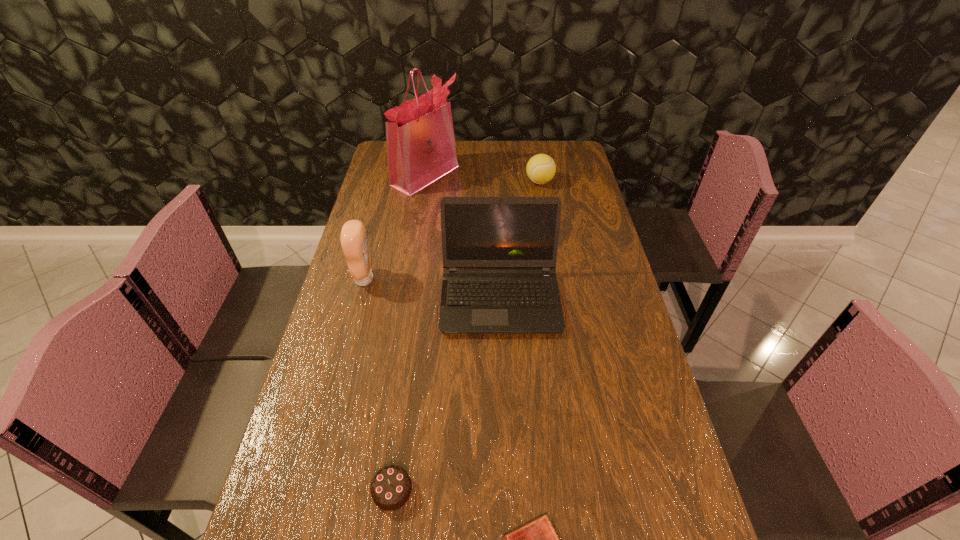
Where is `the tallest object`? This screenshot has width=960, height=540. the tallest object is located at coordinates (421, 148).

Find the location of a particular element. The image size is (960, 540). the fifth shortest object is located at coordinates (499, 254).

The image size is (960, 540). I want to click on condiment, so click(x=353, y=237).

Find the location of a particular element. The image size is (960, 540). tennis ball is located at coordinates (541, 168).

Identify the location of the second nearest object. The height and width of the screenshot is (540, 960). (391, 488).

Identify the location of chocolate cake. This screenshot has height=540, width=960. (391, 488).

Identify the location of free location located 0.180m on the right of the shopping bag. This screenshot has width=960, height=540. (503, 176).

Find the location of `vacant space located on the screen of the fifth shortest object`. vacant space located on the screen of the fifth shortest object is located at coordinates (505, 416).

What are the coordinates of `free space located 0.340m on the label of the condiment` in the screenshot? It's located at (486, 279).

You are a GUI agent. You are given a task and a screenshot of the screen. Output one action in this format:
    pyautogui.click(x=<x>, y=<y>)
    Task: Click on the vacant space situated 0.060m on the back of the tennis ball
    
    Given the screenshot: What is the action you would take?
    pyautogui.click(x=537, y=166)